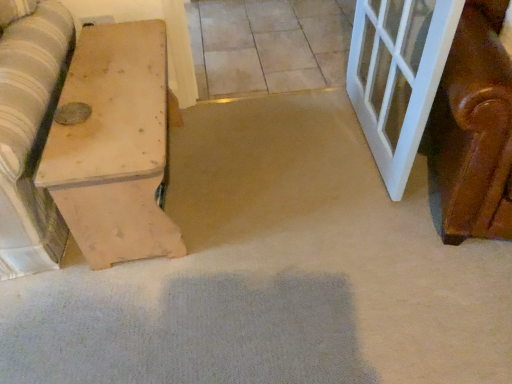
At what (x,y) coordinates should I click in order to perform the action: click on vacant area that is in front of light brown wood chest at left. Please return your answer as a coordinate pair (x, y). Looking at the image, I should click on (152, 318).